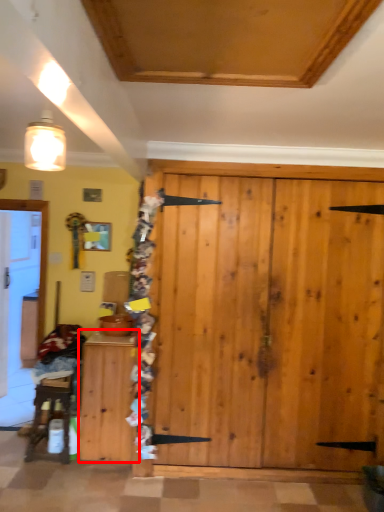
Question: From the image's perspective, where is cabinetry (annotated by the red box) located in relation to furniture in the image?

Choices:
 (A) above
 (B) below

Answer: (A)